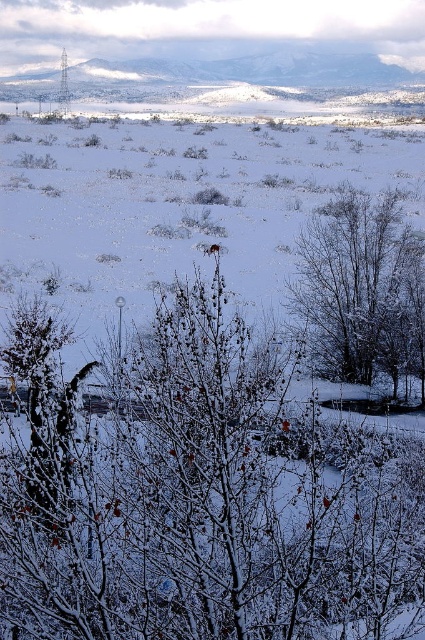
Question: Considering the relative positions of snow-covered branches at center and white powdery snow at center in the image provided, where is snow-covered branches at center located with respect to white powdery snow at center?

Choices:
 (A) above
 (B) below

Answer: (B)

Question: Which object is closer to the camera taking this photo?

Choices:
 (A) snow-covered branches at center-right
 (B) white powdery snow at center
 (C) snow-covered branches at center

Answer: (C)

Question: Which point appears closest to the camera in this image?

Choices:
 (A) (59, 630)
 (B) (368, 269)

Answer: (A)

Question: Is white powdery snow at center wider than snow-covered branches at center-right?

Choices:
 (A) yes
 (B) no

Answer: (A)

Question: Is snow-covered branches at center positioned in front of white powdery snow at center?

Choices:
 (A) yes
 (B) no

Answer: (A)

Question: Which object is the closest to the white powdery snow at center?

Choices:
 (A) snow-covered branches at center
 (B) snow-covered branches at center-right

Answer: (A)